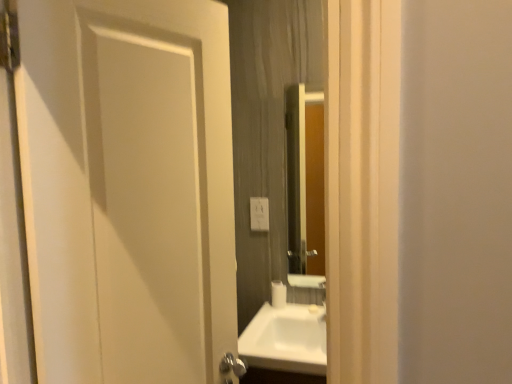
Question: Is smooth wooden mirror at center not near white glossy sink at center?

Choices:
 (A) no
 (B) yes

Answer: (A)

Question: Can you confirm if smooth wooden mirror at center is thinner than white glossy sink at center?

Choices:
 (A) no
 (B) yes

Answer: (B)

Question: Considering the relative positions of smooth wooden mirror at center and white glossy sink at center in the image provided, is smooth wooden mirror at center to the right of white glossy sink at center from the viewer's perspective?

Choices:
 (A) no
 (B) yes

Answer: (B)

Question: Is smooth wooden mirror at center closer to the viewer compared to white glossy sink at center?

Choices:
 (A) no
 (B) yes

Answer: (A)

Question: From a real-world perspective, is smooth wooden mirror at center beneath white glossy sink at center?

Choices:
 (A) no
 (B) yes

Answer: (A)

Question: Is smooth wooden mirror at center further to the viewer compared to white glossy sink at center?

Choices:
 (A) no
 (B) yes

Answer: (B)

Question: Are white plastic electric outlet at center and smooth wooden mirror at center making contact?

Choices:
 (A) no
 (B) yes

Answer: (A)

Question: From a real-world perspective, is white plastic electric outlet at center beneath smooth wooden mirror at center?

Choices:
 (A) no
 (B) yes

Answer: (B)

Question: Can you confirm if white plastic electric outlet at center is thinner than smooth wooden mirror at center?

Choices:
 (A) yes
 (B) no

Answer: (A)

Question: Is white plastic electric outlet at center to the left of smooth wooden mirror at center from the viewer's perspective?

Choices:
 (A) no
 (B) yes

Answer: (B)

Question: Are white plastic electric outlet at center and smooth wooden mirror at center located far from each other?

Choices:
 (A) no
 (B) yes

Answer: (A)

Question: Can you confirm if white plastic electric outlet at center is wider than smooth wooden mirror at center?

Choices:
 (A) no
 (B) yes

Answer: (A)

Question: Is smooth wooden mirror at center facing away from white plastic electric outlet at center?

Choices:
 (A) yes
 (B) no

Answer: (B)